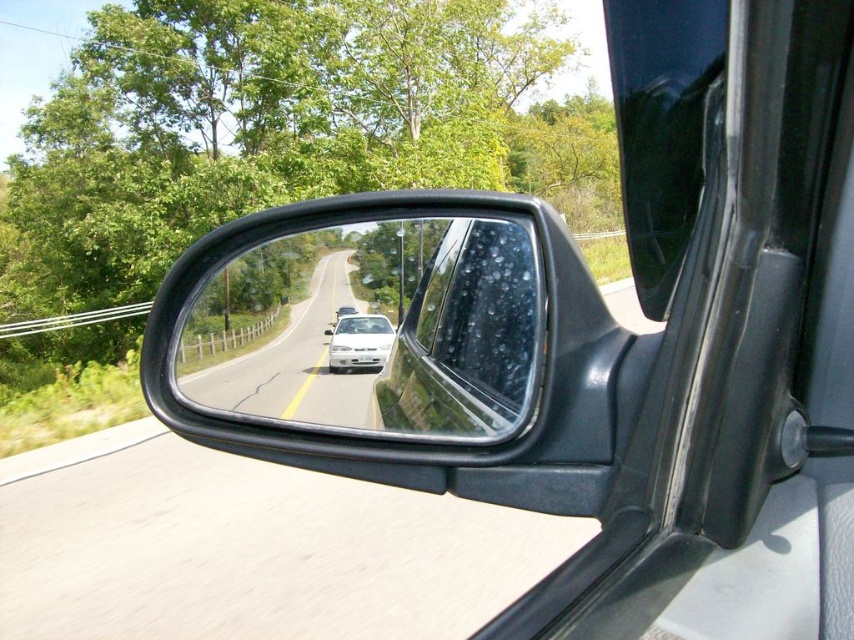
Question: Can you confirm if clear plastic mirror at center is wider than transparent wet glass at center?

Choices:
 (A) yes
 (B) no

Answer: (A)

Question: Among these objects, which one is farthest from the camera?

Choices:
 (A) clear plastic mirror at center
 (B) transparent wet glass at center

Answer: (B)

Question: Estimate the real-world distances between objects in this image. Which object is farther from the white glossy sedan at center?

Choices:
 (A) transparent wet glass at center
 (B) white glossy car at center

Answer: (A)

Question: Estimate the real-world distances between objects in this image. Which object is farther from the transparent wet glass at center?

Choices:
 (A) white glossy sedan at center
 (B) white glossy car at center

Answer: (B)

Question: Is transparent wet glass at center below white glossy car at center?

Choices:
 (A) no
 (B) yes

Answer: (A)

Question: Does clear plastic mirror at center have a greater width compared to white glossy car at center?

Choices:
 (A) no
 (B) yes

Answer: (B)